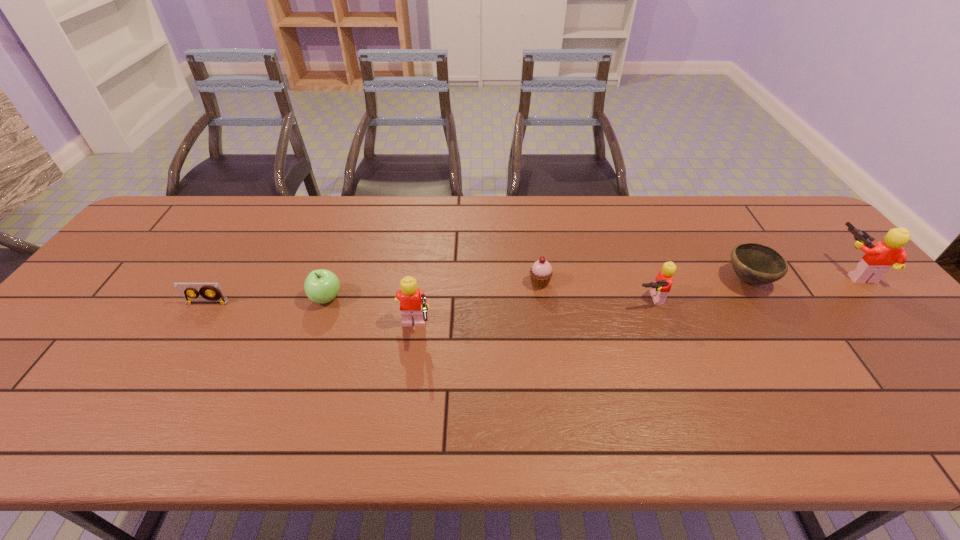
You are a GUI agent. You are given a task and a screenshot of the screen. Output one action in this format:
    pyautogui.click(x=<x>, y=<y>)
    Task: Click on the leftmost object
    
    Given the screenshot: What is the action you would take?
    pyautogui.click(x=209, y=292)

Find the location of a particular element. free region located in front of the nearest object with the accessory visible is located at coordinates (525, 330).

Identify the location of vacant space located 0.270m in front of the shortest Lego with the accessory visible. The width and height of the screenshot is (960, 540). (688, 403).

Image resolution: width=960 pixels, height=540 pixels. I want to click on free region located 0.240m in front of the rightmost Lego with the accessory visible, so click(751, 272).

Find the location of a particular element. The image size is (960, 540). free spot located in front of the rightmost Lego with the accessory visible is located at coordinates (797, 272).

Find the location of a particular element. Image resolution: width=960 pixels, height=540 pixels. vacant area located 0.120m in front of the rightmost Lego with the accessory visible is located at coordinates (793, 272).

This screenshot has height=540, width=960. I want to click on free space located 0.390m on the back of the second object from left to right, so click(358, 205).

This screenshot has width=960, height=540. In order to click on free space located on the left of the cupcake in this screenshot , I will do `click(492, 283)`.

Locate an element on the screen. vacant region located on the front of the second object from right to left is located at coordinates pyautogui.click(x=768, y=312).

Where is `vacant area located 0.270m at the front of the videotape with visible reels`? The height and width of the screenshot is (540, 960). vacant area located 0.270m at the front of the videotape with visible reels is located at coordinates (151, 396).